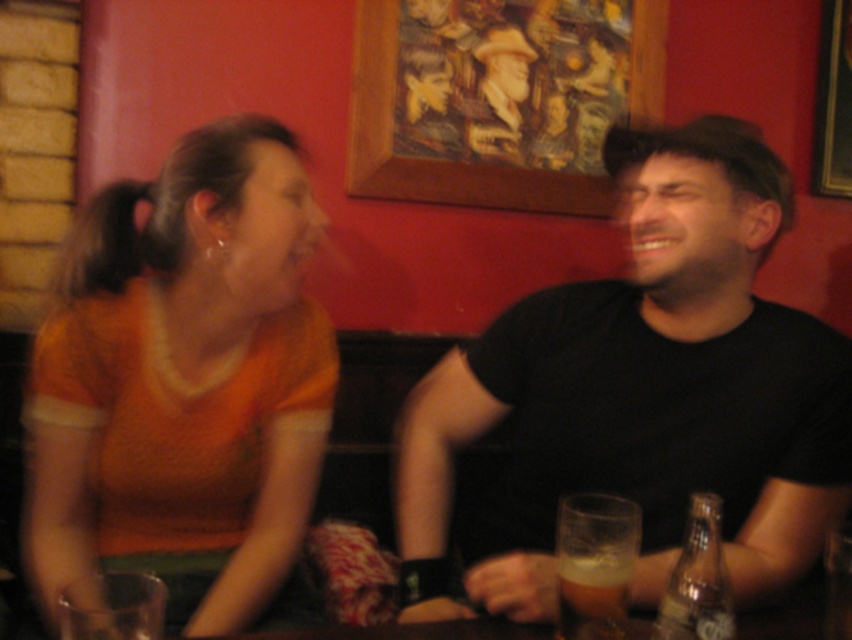
Does black matte shirt at center appear on the left side of orange jersey at left?

Incorrect, black matte shirt at center is not on the left side of orange jersey at left.

Who is lower down, black matte shirt at center or orange jersey at left?

Positioned lower is orange jersey at left.

Which is in front, point (715, 349) or point (285, 387)?

Point (715, 349) is in front.

Locate an element on the screen. The height and width of the screenshot is (640, 852). black matte shirt at center is located at coordinates (645, 390).

Does black matte shirt at center have a larger size compared to foamy amber beer at lower center?

Indeed, black matte shirt at center has a larger size compared to foamy amber beer at lower center.

Between black matte shirt at center and foamy amber beer at lower center, which one is positioned lower?

foamy amber beer at lower center is below.

This screenshot has width=852, height=640. Describe the element at coordinates (645, 390) in the screenshot. I see `black matte shirt at center` at that location.

In order to click on black matte shirt at center in this screenshot , I will do `click(645, 390)`.

Between orange jersey at left and foamy amber beer at lower center, which one has less height?

foamy amber beer at lower center

Is point (204, 154) positioned after point (614, 588)?

Yes, it is.

I want to click on orange jersey at left, so click(x=183, y=376).